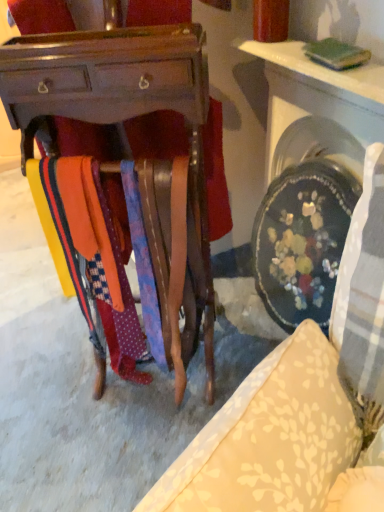
Find the location of a particular element. Image resolution: width=384 pixels, height=512 pixels. vacant point to the left of polka dot fabric tie at center is located at coordinates (104, 396).